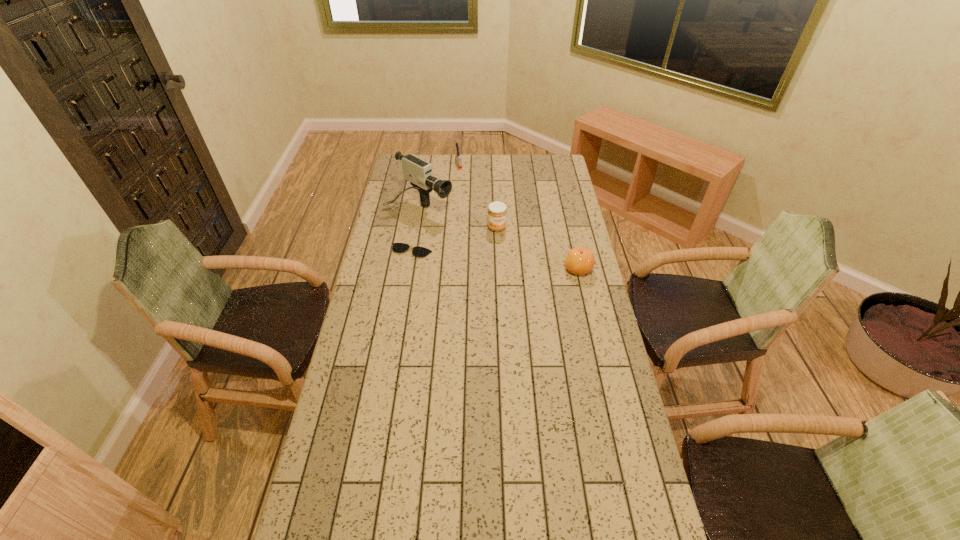
The width and height of the screenshot is (960, 540). Find the location of `free space on the desktop that is between the shortest object and the clementine and is positioned on the recording direction of the tallest object`. free space on the desktop that is between the shortest object and the clementine and is positioned on the recording direction of the tallest object is located at coordinates (516, 262).

Identify the location of free space on the desktop that is between the spectacles and the rightmost object and is positioned on the handle side of the stapler. (493, 260).

Locate an element on the screen. Image resolution: width=960 pixels, height=540 pixels. vacant spot on the desktop that is between the shortest object and the rightmost object and is positioned on the front label of the jam is located at coordinates (516, 262).